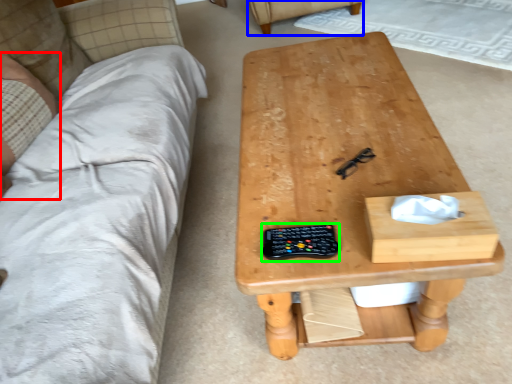
Question: Based on their relative distances, which object is farther from person (highlighted by a red box)? Choose from armchair (highlighted by a blue box) and control (highlighted by a green box).

Choices:
 (A) armchair
 (B) control

Answer: (A)